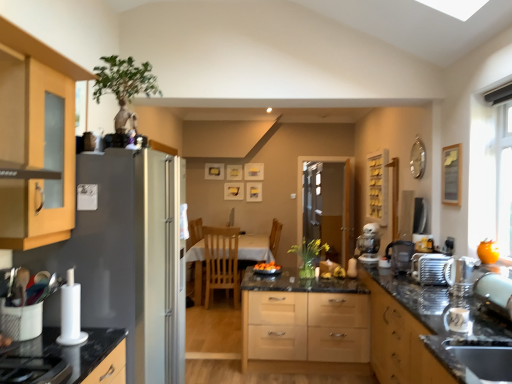
Question: Considering the relative sizes of orange matte bowl at center and satin silver toaster at right in the image provided, is orange matte bowl at center wider than satin silver toaster at right?

Choices:
 (A) yes
 (B) no

Answer: (A)

Question: From a real-world perspective, is orange matte bowl at center below satin silver toaster at right?

Choices:
 (A) no
 (B) yes

Answer: (B)

Question: From the image's perspective, is orange matte bowl at center located above satin silver toaster at right?

Choices:
 (A) no
 (B) yes

Answer: (A)

Question: From the image's perspective, is orange matte bowl at center below satin silver toaster at right?

Choices:
 (A) no
 (B) yes

Answer: (B)

Question: Does orange matte bowl at center appear on the right side of satin silver toaster at right?

Choices:
 (A) no
 (B) yes

Answer: (A)

Question: From a real-world perspective, is white plastic coffee machine at right physically located above or below white glossy table at center?

Choices:
 (A) below
 (B) above

Answer: (B)

Question: From the image's perspective, is white plastic coffee machine at right located above or below white glossy table at center?

Choices:
 (A) above
 (B) below

Answer: (A)

Question: Does point coord(368,231) appear closer or farther from the camera than point coord(244,243)?

Choices:
 (A) farther
 (B) closer

Answer: (B)

Question: Considering their positions, is white plastic coffee machine at right located in front of or behind white glossy table at center?

Choices:
 (A) behind
 (B) front

Answer: (B)

Question: Do you think translucent glass vase at center is within satin silver toaster at right, or outside of it?

Choices:
 (A) outside
 (B) inside

Answer: (A)

Question: From the image's perspective, is translucent glass vase at center positioned above or below satin silver toaster at right?

Choices:
 (A) below
 (B) above

Answer: (A)

Question: Is point (295, 251) closer or farther from the camera than point (430, 271)?

Choices:
 (A) farther
 (B) closer

Answer: (A)

Question: Considering the positions of translucent glass vase at center and satin silver toaster at right in the image, is translucent glass vase at center taller or shorter than satin silver toaster at right?

Choices:
 (A) tall
 (B) short

Answer: (A)

Question: From a real-world perspective, is satin silver toaster at right above or below wooden cabinet at upper center, which appears as the second cabinetry when viewed from the front?

Choices:
 (A) below
 (B) above

Answer: (A)

Question: Is satin silver toaster at right bigger or smaller than wooden cabinet at upper center, the first cabinetry positioned from the right?

Choices:
 (A) small
 (B) big

Answer: (A)